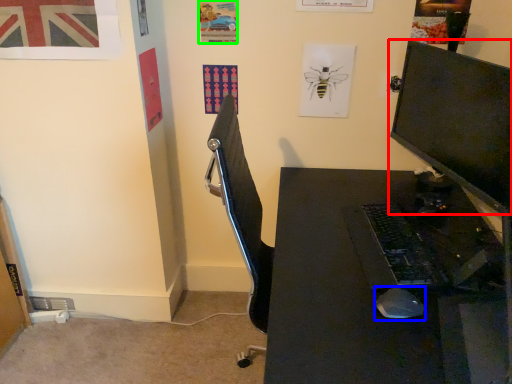
Question: Considering the real-world distances, which object is farthest from computer monitor (highlighted by a red box)? mouse (highlighted by a blue box) or poster page (highlighted by a green box)?

Choices:
 (A) mouse
 (B) poster page

Answer: (B)